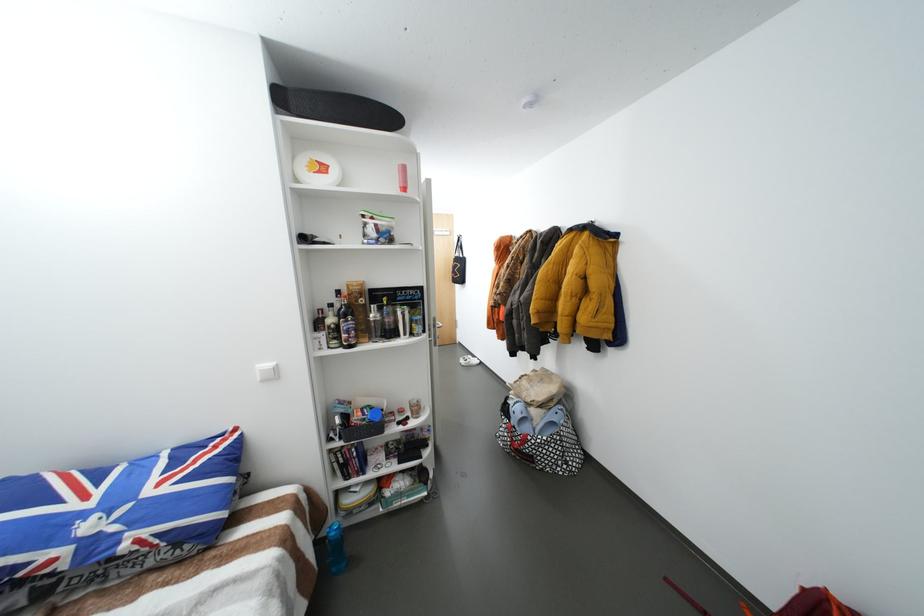
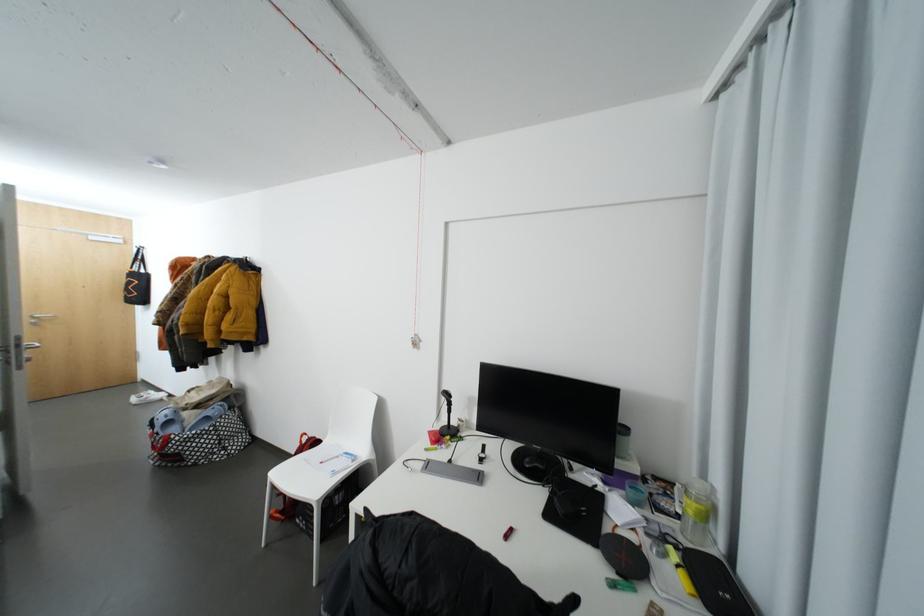
Where in the second image is the point corresponding to [574,464] from the first image?

(232, 448)